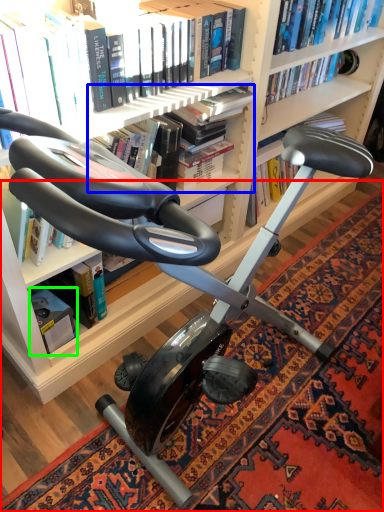
Question: Considering the real-world distances, which object is closest to mat (highlighted by a red box)? book (highlighted by a blue box) or paperback book (highlighted by a green box).

Choices:
 (A) book
 (B) paperback book

Answer: (B)